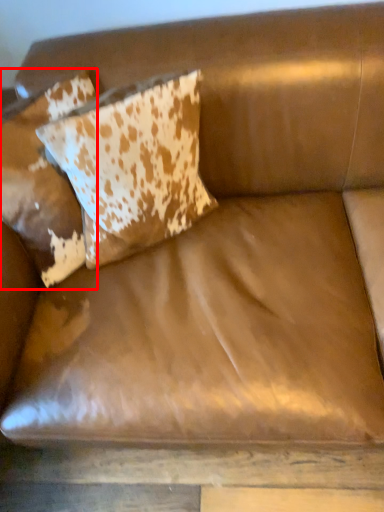
Question: Considering the relative positions of pillow (annotated by the red box) and pillow in the image provided, where is pillow (annotated by the red box) located with respect to the staircase?

Choices:
 (A) right
 (B) left

Answer: (B)